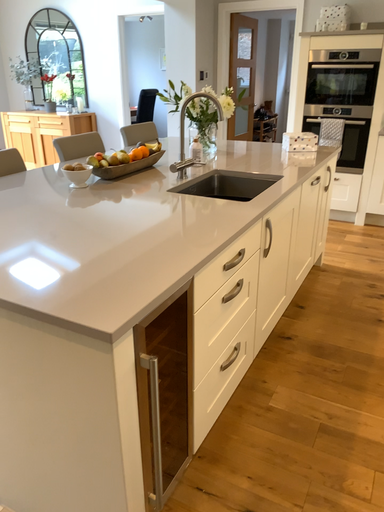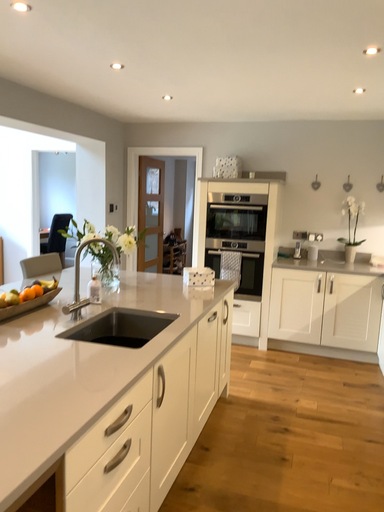
Question: How did the camera likely rotate when shooting the video?

Choices:
 (A) rotated left
 (B) rotated right

Answer: (B)